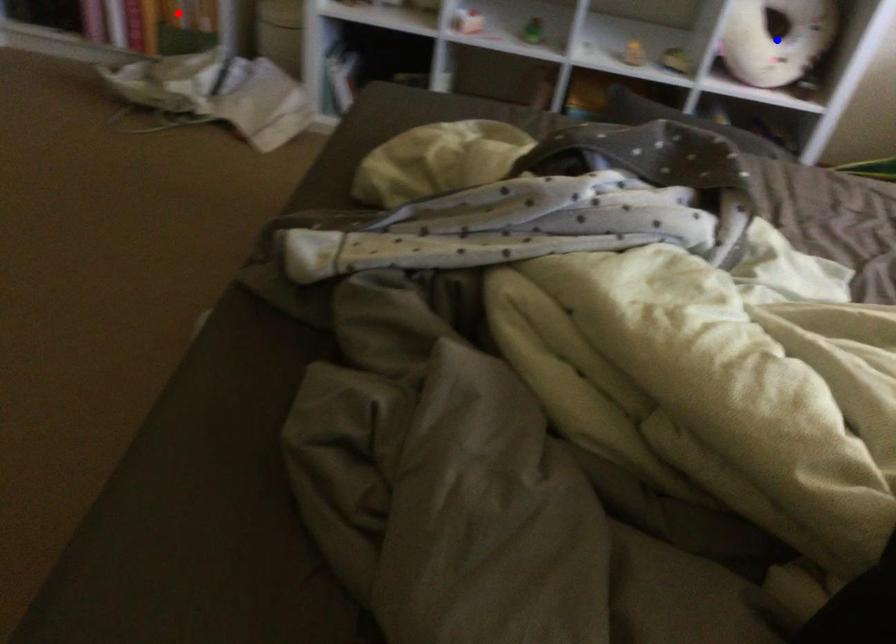
Question: Two points are marked on the image. Which point is closer to the camera?

Choices:
 (A) Blue point is closer.
 (B) Red point is closer.

Answer: (A)